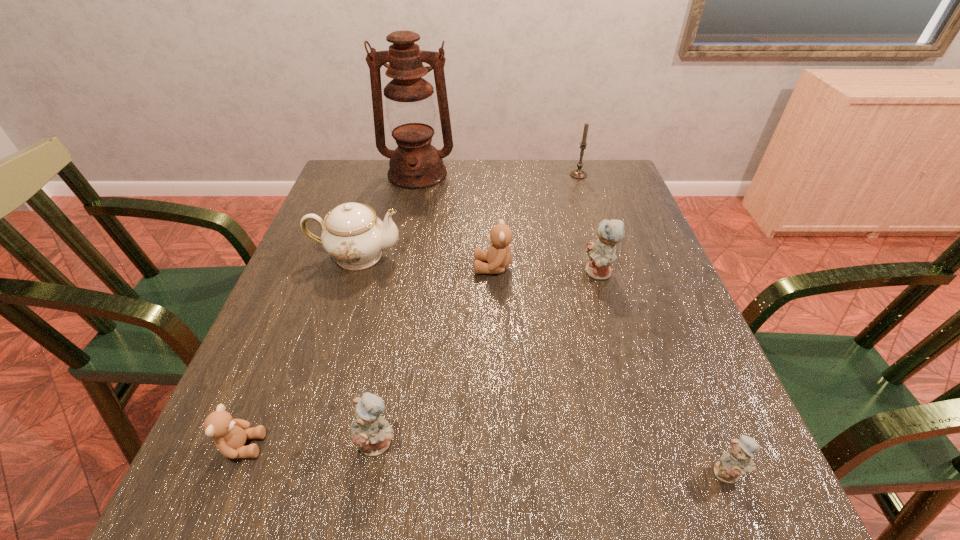
This screenshot has width=960, height=540. I want to click on the closest teddy bear to the bigger brown teddy bear, so click(601, 252).

Find the location of a particular element. The width and height of the screenshot is (960, 540). blue teddy bear that stands as the second closest to the nearer brown teddy bear is located at coordinates (601, 252).

What are the coordinates of `the closest blue teddy bear relative to the rightmost blue teddy bear` in the screenshot? It's located at (601, 252).